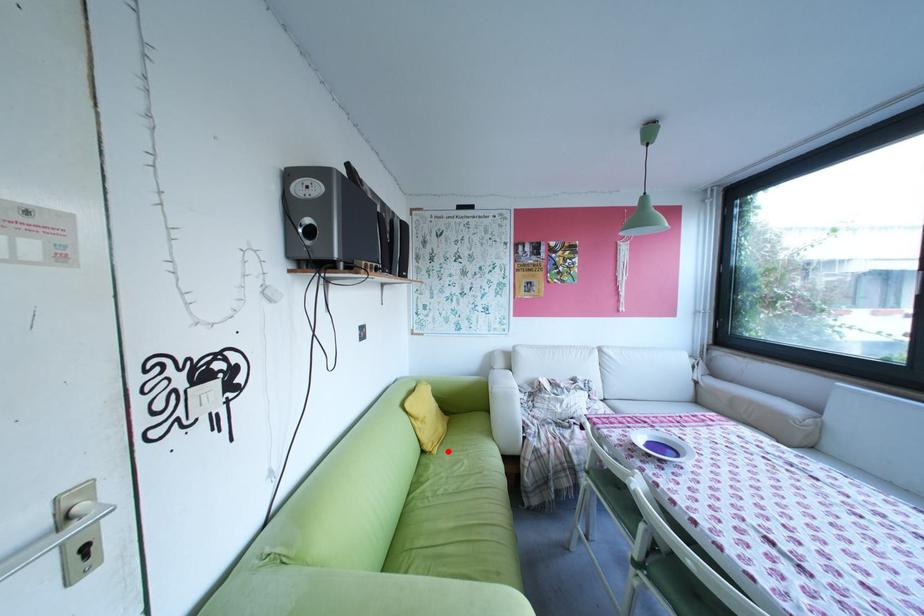
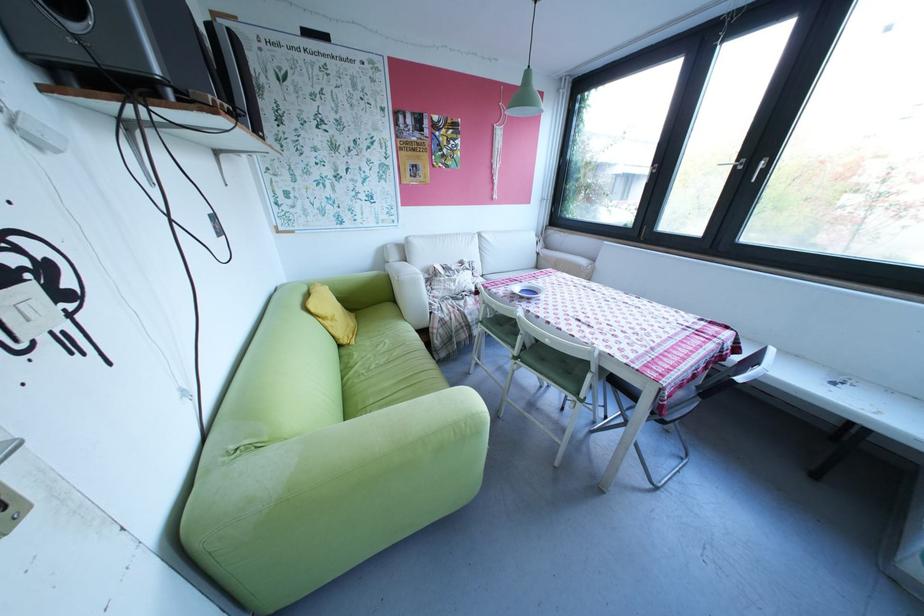
The point at the highlighted location is marked in the first image. Where is the corresponding point in the second image?

(366, 342)